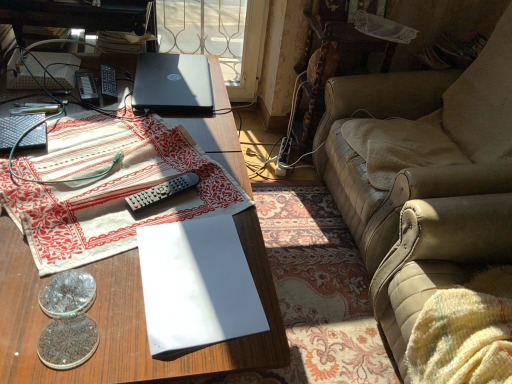
Locate an element on the screen. Image resolution: width=512 pixels, height=384 pixels. vacant space situated on the left part of black plastic remote control at upper left, the 3th remote control from the right is located at coordinates (42, 91).